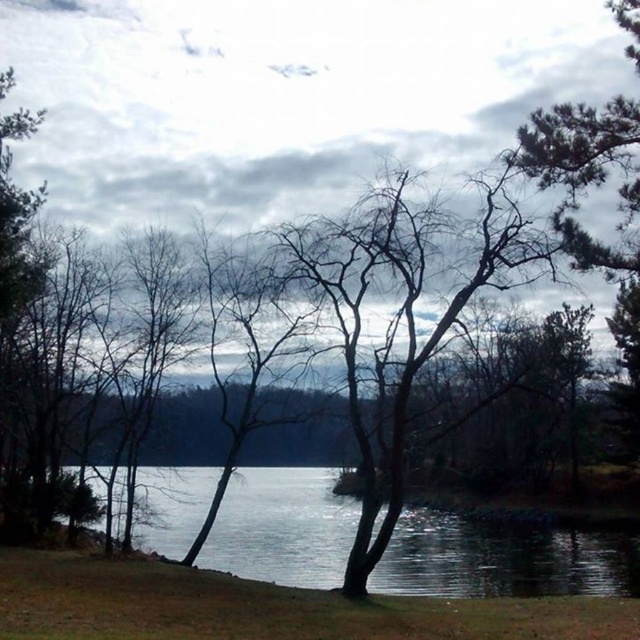
You are planning to cross the lake using a small boat that can only handle calm waters. Based on the scene, can you determine if the transparent water at center is wide enough to accommodate your boat compared to the bare branches at center?

The transparent water at center might be wider than bare branches at center, so it could be wide enough for your boat. However, since the exact width isn not specified, proceed with caution considering the calm waters mentioned.

You are an artist trying to paint the scene. You want to ensure the transparent water at center and the bare branches at center are proportionally accurate. Which one should you draw taller in your painting?

The transparent water at center is taller than bare branches at center, so you should draw the transparent water at center taller than the bare branches at center in your painting.